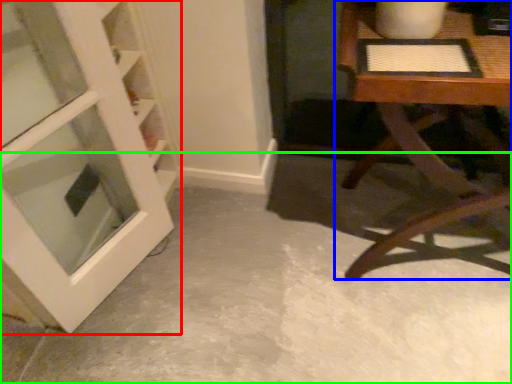
Question: Based on their relative distances, which object is nearer to door (highlighted by a red box)? Choose from table (highlighted by a blue box) and concrete (highlighted by a green box).

Choices:
 (A) table
 (B) concrete

Answer: (B)